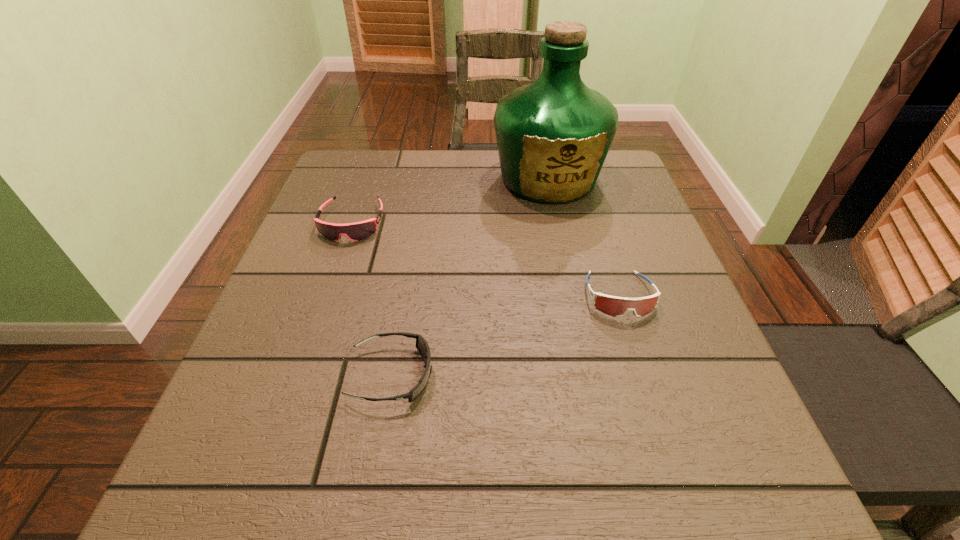
Locate an element on the screen. Image resolution: width=960 pixels, height=540 pixels. the tallest object is located at coordinates (553, 135).

You are a GUI agent. You are given a task and a screenshot of the screen. Output one action in this format:
    pyautogui.click(x=<x>, y=<y>)
    Task: Click on the rightmost goggles
    
    Given the screenshot: What is the action you would take?
    pyautogui.click(x=614, y=306)

At what (x,y) coordinates should I click in order to perform the action: click on the second nearest object. Please return your answer as a coordinate pair (x, y). Looking at the image, I should click on (614, 306).

Image resolution: width=960 pixels, height=540 pixels. Identify the location of the leftmost goggles. (357, 231).

Identify the location of the leftmost object. This screenshot has width=960, height=540. (357, 231).

Where is `the nearest object`? Image resolution: width=960 pixels, height=540 pixels. the nearest object is located at coordinates (422, 346).

The image size is (960, 540). What are the coordinates of `the nearest goggles` in the screenshot? It's located at (422, 346).

This screenshot has height=540, width=960. Find the location of `vacant region located 0.400m on the label side of the liquor`. vacant region located 0.400m on the label side of the liquor is located at coordinates (583, 346).

Find the location of a particular element. The height and width of the screenshot is (540, 960). vacant area situated on the front-facing side of the rightmost goggles is located at coordinates (643, 373).

Where is `blank space located on the front-facing side of the leftmost goggles`? blank space located on the front-facing side of the leftmost goggles is located at coordinates (334, 275).